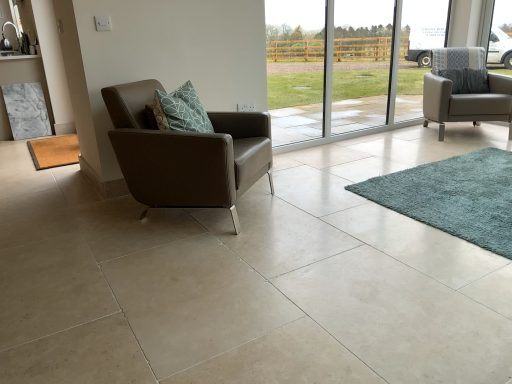
Find the location of a particular element. The image size is (512, 384). free location in front of brown leather armchair at left, marked as the 1th chair in a left-to-right arrangement is located at coordinates (162, 266).